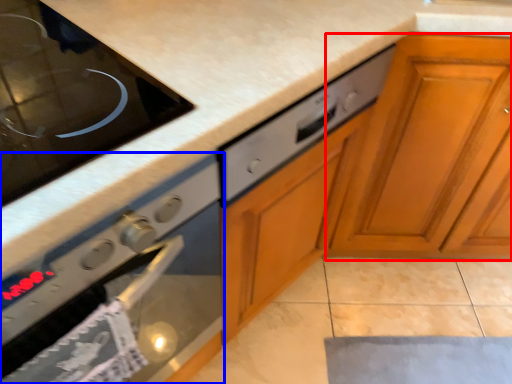
Question: Which object is further to the camera taking this photo, cabinetry (highlighted by a red box) or oven (highlighted by a blue box)?

Choices:
 (A) cabinetry
 (B) oven

Answer: (A)